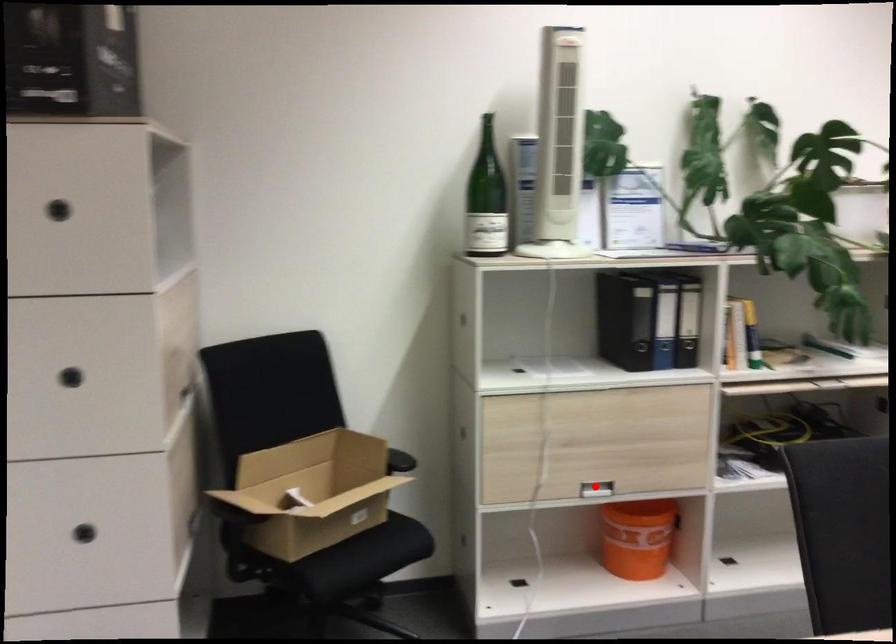
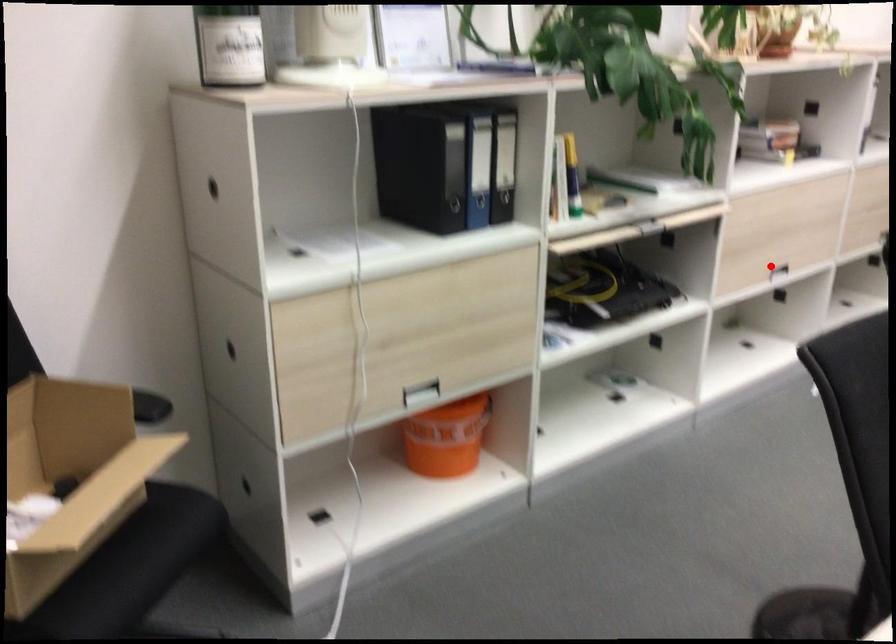
I am providing you with two images of the same scene from different viewpoints. A red point is marked on the first image and another point is marked on the second image. Does the point marked in image1 correspond to the same location as the one in image2?

No